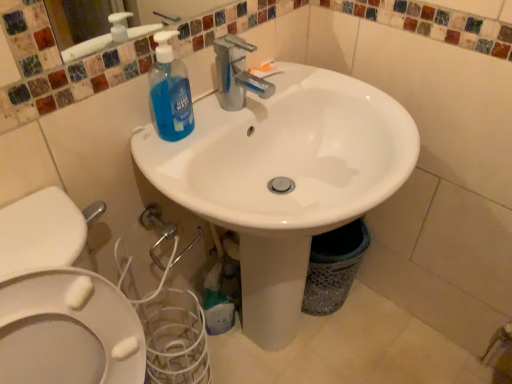
Looking at this image, what is the approximate width of blue translucent liquid soap at upper left, placed as the 2th cleaning product when sorted from back to front?

blue translucent liquid soap at upper left, placed as the 2th cleaning product when sorted from back to front, is 2.53 inches in width.

The height and width of the screenshot is (384, 512). Describe the element at coordinates (217, 303) in the screenshot. I see `translucent plastic bottle at lower center, acting as the 2th cleaning product starting from the top` at that location.

Locate an element on the screen. white glossy sink at center is located at coordinates (284, 178).

I want to click on blue translucent liquid soap at upper left, placed as the 2th cleaning product when sorted from back to front, so point(170,91).

Which of these two, white glossy sink at center or translucent plastic bottle at lower center, arranged as the 1th cleaning product when viewed from the back, is bigger?

Bigger between the two is white glossy sink at center.

Is white glossy sink at center not near translucent plastic bottle at lower center, arranged as the 1th cleaning product when viewed from the back?

Actually, white glossy sink at center and translucent plastic bottle at lower center, arranged as the 1th cleaning product when viewed from the back, are a little close together.

Considering the relative sizes of blue translucent liquid soap at upper left, which ranks as the first cleaning product in front-to-back order, and white glossy sink at center in the image provided, is blue translucent liquid soap at upper left, which ranks as the first cleaning product in front-to-back order, taller than white glossy sink at center?

No, blue translucent liquid soap at upper left, which ranks as the first cleaning product in front-to-back order, is not taller than white glossy sink at center.

Does blue translucent liquid soap at upper left, the 2th cleaning product ordered from the bottom, have a smaller size compared to white glossy sink at center?

Correct, blue translucent liquid soap at upper left, the 2th cleaning product ordered from the bottom, occupies less space than white glossy sink at center.

Which object is wider, blue translucent liquid soap at upper left, the 2th cleaning product ordered from the bottom, or white glossy sink at center?

white glossy sink at center is wider.

Which is in front, point (167, 51) or point (225, 301)?

The point (167, 51) is closer.

Considering the relative positions of blue translucent liquid soap at upper left, which ranks as the first cleaning product in front-to-back order, and translucent plastic bottle at lower center, positioned as the 2th cleaning product in front-to-back order, in the image provided, is blue translucent liquid soap at upper left, which ranks as the first cleaning product in front-to-back order, to the right of translucent plastic bottle at lower center, positioned as the 2th cleaning product in front-to-back order, from the viewer's perspective?

In fact, blue translucent liquid soap at upper left, which ranks as the first cleaning product in front-to-back order, is to the left of translucent plastic bottle at lower center, positioned as the 2th cleaning product in front-to-back order.

Choose the correct answer: Is blue translucent liquid soap at upper left, the 2th cleaning product ordered from the bottom, inside translucent plastic bottle at lower center, the first cleaning product when ordered from bottom to top, or outside it?

blue translucent liquid soap at upper left, the 2th cleaning product ordered from the bottom, is not enclosed by translucent plastic bottle at lower center, the first cleaning product when ordered from bottom to top.

Is white glossy sink at center positioned with its back to blue translucent liquid soap at upper left, positioned as the first cleaning product in top-to-bottom order?

Yes.

Does point (244, 168) appear closer or farther from the camera than point (187, 84)?

Point (244, 168).

Find the location of `cleaning product above the white glossy sink at center (from the image's perspective)`. cleaning product above the white glossy sink at center (from the image's perspective) is located at coordinates (170, 91).

Can you confirm if translucent plastic bottle at lower center, acting as the 2th cleaning product starting from the top, is taller than white glossy sink at center?

Incorrect, the height of translucent plastic bottle at lower center, acting as the 2th cleaning product starting from the top, is not larger of that of white glossy sink at center.

Does translucent plastic bottle at lower center, positioned as the 2th cleaning product in front-to-back order, appear on the right side of white glossy sink at center?

No.

In terms of size, does translucent plastic bottle at lower center, positioned as the 2th cleaning product in front-to-back order, appear bigger or smaller than white glossy sink at center?

translucent plastic bottle at lower center, positioned as the 2th cleaning product in front-to-back order, is smaller than white glossy sink at center.

The image size is (512, 384). I want to click on sink in front of the translucent plastic bottle at lower center, positioned as the 2th cleaning product in front-to-back order, so click(x=284, y=178).

Find the location of a particular element. The width and height of the screenshot is (512, 384). cleaning product that appears below the blue translucent liquid soap at upper left, positioned as the first cleaning product in top-to-bottom order (from the image's perspective) is located at coordinates (217, 303).

Consider the image. Is translucent plastic bottle at lower center, the first cleaning product when ordered from bottom to top, far away from blue translucent liquid soap at upper left, placed as the 2th cleaning product when sorted from back to front?

They are positioned close to each other.

Is translucent plastic bottle at lower center, acting as the 2th cleaning product starting from the top, thinner than blue translucent liquid soap at upper left, which ranks as the first cleaning product in front-to-back order?

Incorrect, the width of translucent plastic bottle at lower center, acting as the 2th cleaning product starting from the top, is not less than that of blue translucent liquid soap at upper left, which ranks as the first cleaning product in front-to-back order.

Is translucent plastic bottle at lower center, acting as the 2th cleaning product starting from the top, smaller than blue translucent liquid soap at upper left, placed as the 2th cleaning product when sorted from back to front?

Incorrect, translucent plastic bottle at lower center, acting as the 2th cleaning product starting from the top, is not smaller in size than blue translucent liquid soap at upper left, placed as the 2th cleaning product when sorted from back to front.

Locate an element on the screen. This screenshot has height=384, width=512. sink above the translucent plastic bottle at lower center, arranged as the 1th cleaning product when viewed from the back (from the image's perspective) is located at coordinates (284, 178).

Image resolution: width=512 pixels, height=384 pixels. I want to click on cleaning product located above the white glossy sink at center (from a real-world perspective), so click(x=170, y=91).

Estimate the real-world distances between objects in this image. Which object is closer to white glossy sink at center, translucent plastic bottle at lower center, positioned as the 2th cleaning product in front-to-back order, or blue translucent liquid soap at upper left, positioned as the first cleaning product in top-to-bottom order?

blue translucent liquid soap at upper left, positioned as the first cleaning product in top-to-bottom order.

Looking at this image, from the image, which object appears to be nearer to blue translucent liquid soap at upper left, which ranks as the first cleaning product in front-to-back order, translucent plastic bottle at lower center, acting as the 2th cleaning product starting from the top, or white glossy sink at center?

white glossy sink at center.

In the scene shown: Which object lies nearer to the anchor point translucent plastic bottle at lower center, acting as the 2th cleaning product starting from the top, blue translucent liquid soap at upper left, placed as the 2th cleaning product when sorted from back to front, or white glossy sink at center?

white glossy sink at center is closer to translucent plastic bottle at lower center, acting as the 2th cleaning product starting from the top.

Estimate the real-world distances between objects in this image. Which object is closer to white glossy sink at center, blue translucent liquid soap at upper left, which ranks as the first cleaning product in front-to-back order, or translucent plastic bottle at lower center, positioned as the 2th cleaning product in front-to-back order?

blue translucent liquid soap at upper left, which ranks as the first cleaning product in front-to-back order, lies closer to white glossy sink at center than the other object.

In the scene shown: Looking at the image, which one is located further to blue translucent liquid soap at upper left, the 2th cleaning product ordered from the bottom, white glossy sink at center or translucent plastic bottle at lower center, acting as the 2th cleaning product starting from the top?

translucent plastic bottle at lower center, acting as the 2th cleaning product starting from the top.

When comparing their distances from translucent plastic bottle at lower center, the first cleaning product when ordered from bottom to top, does white glossy sink at center or blue translucent liquid soap at upper left, which ranks as the first cleaning product in front-to-back order, seem closer?

The object closer to translucent plastic bottle at lower center, the first cleaning product when ordered from bottom to top, is white glossy sink at center.

At what (x,y) coordinates should I click in order to perform the action: click on cleaning product between white glossy sink at center and translucent plastic bottle at lower center, arranged as the 1th cleaning product when viewed from the back, in the front-back direction. Please return your answer as a coordinate pair (x, y). Image resolution: width=512 pixels, height=384 pixels. Looking at the image, I should click on (170, 91).